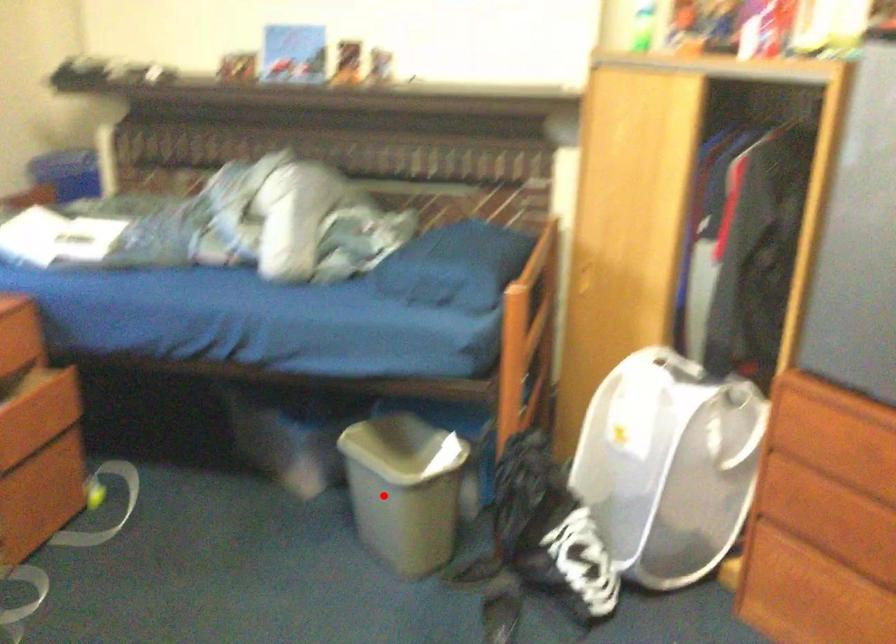
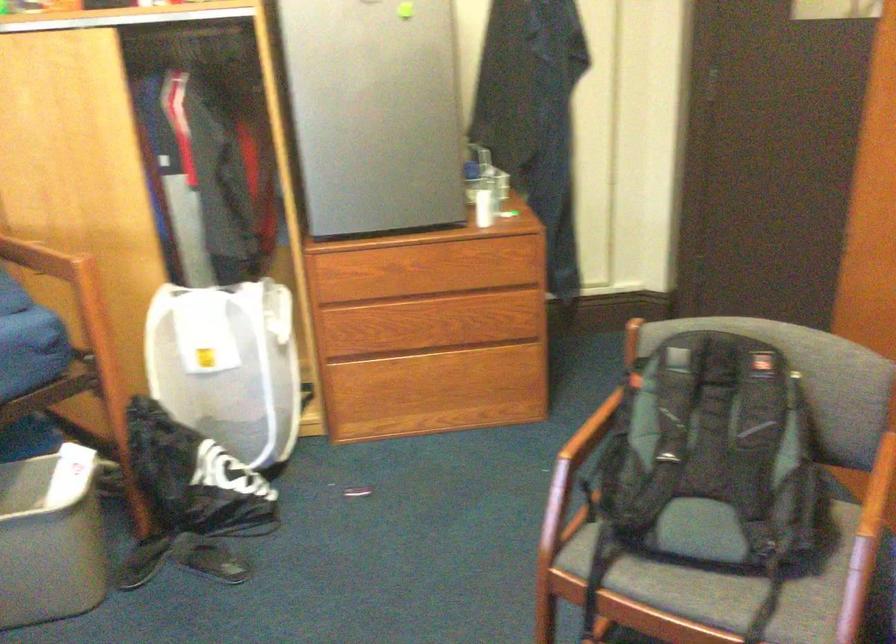
In the second image, find the point that corresponds to the highlighted location in the first image.

(49, 538)